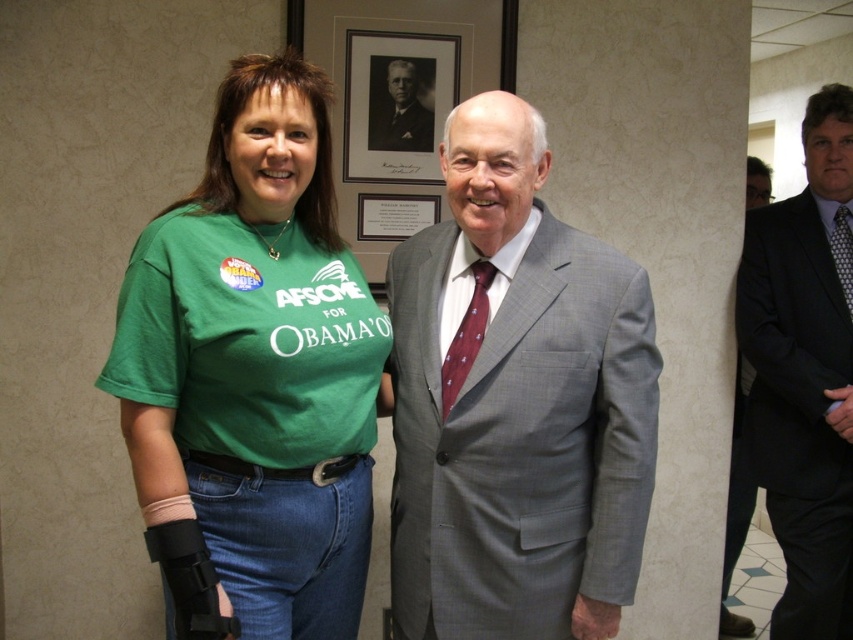
Who is positioned more to the left, gray textured suit at center or maroon textured tie at center?

gray textured suit at center

Who is more distant from viewer, [525,413] or [840,280]?

The point [840,280] is more distant.

You are a GUI agent. You are given a task and a screenshot of the screen. Output one action in this format:
    pyautogui.click(x=<x>, y=<y>)
    Task: Click on the gray textured suit at center
    This screenshot has height=640, width=853.
    Given the screenshot: What is the action you would take?
    pyautogui.click(x=515, y=403)

Can you confirm if black suit at right is thinner than maroon silk tie at center?

No.

Which is behind, point (743, 465) or point (483, 317)?

The point (743, 465) is more distant.

Find the location of a particular element. black suit at right is located at coordinates (735, 508).

Is point (724, 586) more distant than point (402, 106)?

Yes, point (724, 586) is behind point (402, 106).

Is black suit at right thinner than black and white photograph of man at upper center?

Incorrect, black suit at right's width is not less than black and white photograph of man at upper center's.

Between point (726, 524) and point (393, 124), which one is positioned in front?

Point (393, 124) is more forward.

The width and height of the screenshot is (853, 640). Find the location of `black suit at right`. black suit at right is located at coordinates (735, 508).